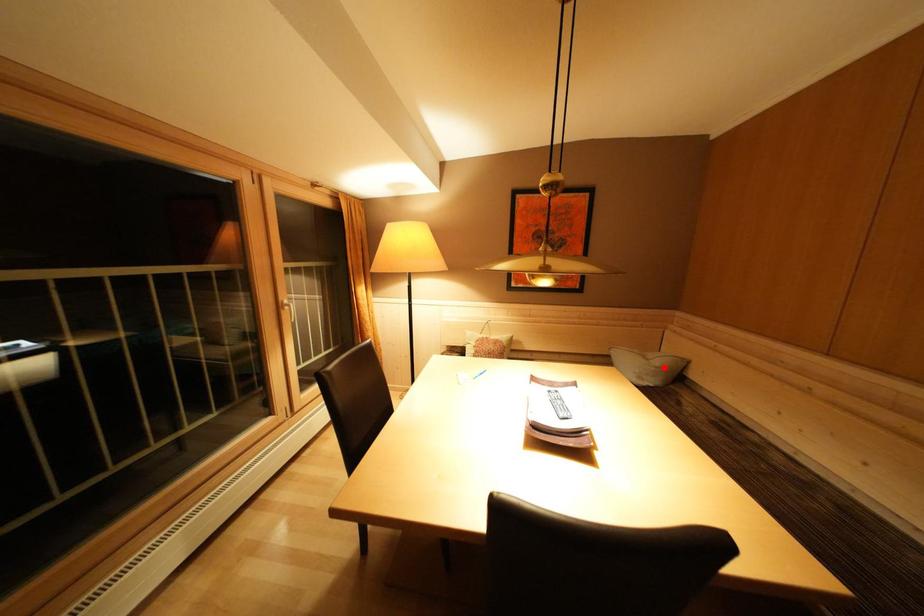
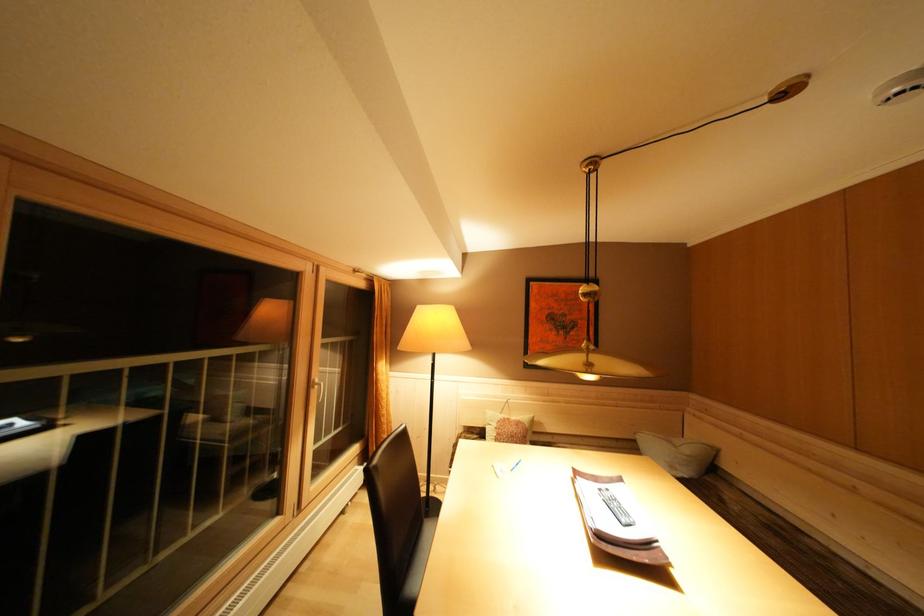
The point at the highlighted location is marked in the first image. Where is the corresponding point in the second image?

(695, 456)